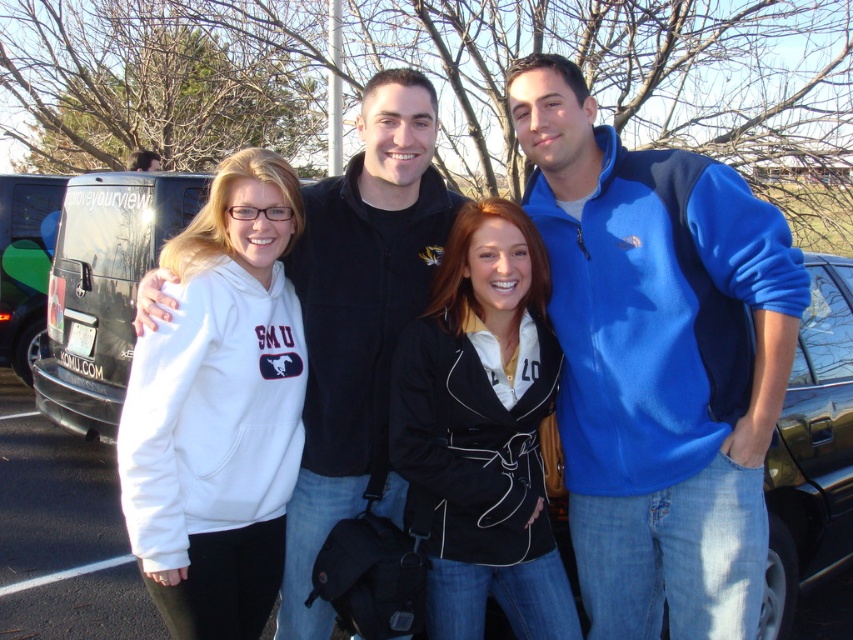
Does white fleece hoodie at left lie in front of green matte van at left?

Yes, white fleece hoodie at left is closer to the viewer.

Can you confirm if white fleece hoodie at left is positioned below green matte van at left?

Yes.

Is point (258, 618) positioned in front of point (57, 209)?

Yes, point (258, 618) is in front of point (57, 209).

Where is `white fleece hoodie at left`? white fleece hoodie at left is located at coordinates (219, 410).

Does white fleece hoodie at left have a lesser height compared to black glossy car at right?

Yes.

Measure the distance between white fleece hoodie at left and camera.

A distance of 7.78 feet exists between white fleece hoodie at left and camera.

Is point (247, 173) positioned in front of point (846, 509)?

Yes, point (247, 173) is in front of point (846, 509).

Locate an element on the screen. white fleece hoodie at left is located at coordinates (219, 410).

Is point (836, 289) closer to viewer compared to point (16, 244)?

Yes, it is.

Describe the element at coordinates (811, 451) in the screenshot. I see `black glossy car at right` at that location.

Describe the element at coordinates (811, 451) in the screenshot. I see `black glossy car at right` at that location.

In order to click on black glossy car at right in this screenshot , I will do `click(811, 451)`.